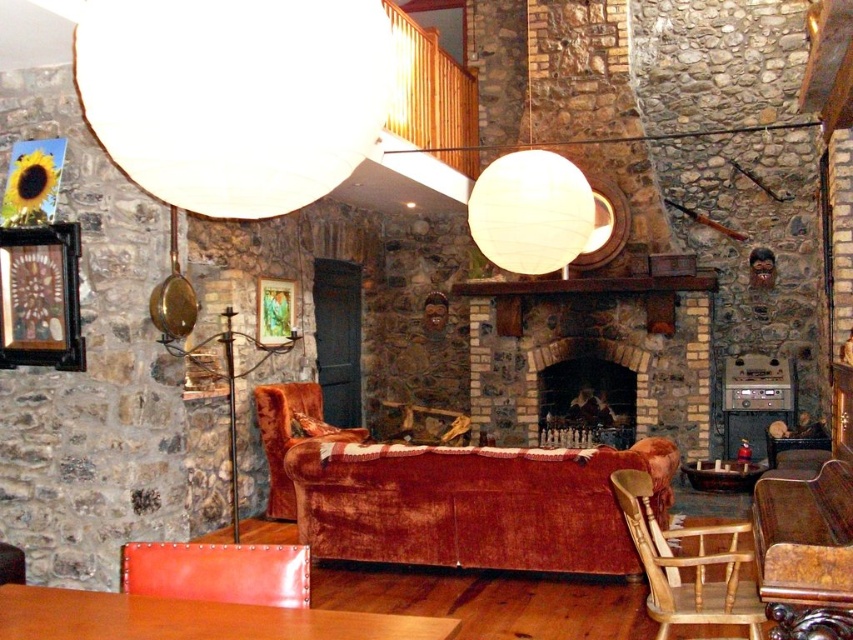
Describe the element at coordinates (805, 552) in the screenshot. I see `wooden table at lower right` at that location.

Is point (796, 616) positioned before point (297, 432)?

Yes, point (796, 616) is closer to viewer.

This screenshot has width=853, height=640. I want to click on wooden table at lower right, so click(805, 552).

The width and height of the screenshot is (853, 640). Identify the location of wooden table at lower right. (805, 552).

Is leather armchair at lower left in front of dark brown stone fireplace at center?

Yes, it is in front of dark brown stone fireplace at center.

Can you confirm if leather armchair at lower left is positioned below dark brown stone fireplace at center?

Yes.

Image resolution: width=853 pixels, height=640 pixels. Describe the element at coordinates (218, 572) in the screenshot. I see `leather armchair at lower left` at that location.

Find the location of `leather armchair at lower left`. leather armchair at lower left is located at coordinates coord(218,572).

Which is below, brick fireplace at center or leather armchair at lower left?

leather armchair at lower left

Can you confirm if brick fireplace at center is bigger than leather armchair at lower left?

Indeed, brick fireplace at center has a larger size compared to leather armchair at lower left.

The image size is (853, 640). Describe the element at coordinates (592, 349) in the screenshot. I see `brick fireplace at center` at that location.

Where is `brick fireplace at center`? brick fireplace at center is located at coordinates (592, 349).